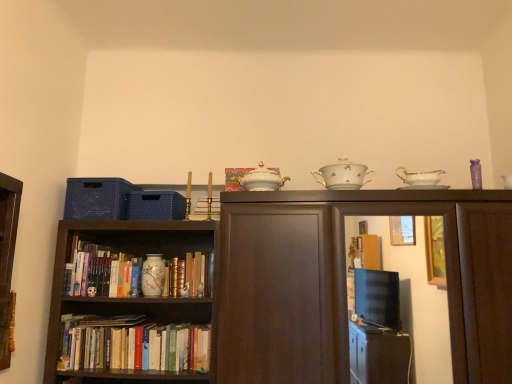
Question: Considering the positions of matte dark wood cabinet at center and porcelain vase at center, the 2th tableware when ordered from right to left, in the image, is matte dark wood cabinet at center taller or shorter than porcelain vase at center, the 2th tableware when ordered from right to left,?

Choices:
 (A) short
 (B) tall

Answer: (B)

Question: From a real-world perspective, is matte dark wood cabinet at center positioned above or below porcelain vase at center, the 2th tableware when ordered from right to left?

Choices:
 (A) below
 (B) above

Answer: (A)

Question: Which object is positioned farthest from the porcelain vase at center, the second tableware viewed from the top?

Choices:
 (A) white porcelain sugar bowl at upper center, which is the 1th tableware from right to left
 (B) matte ceramic book at center, acting as the third book starting from the front
 (C) matte dark wood cabinet at center
 (D) hardcover books at lower center, arranged as the 2th book when viewed from the front
 (E) porcelain bowl at upper center, which appears as the 1th book when viewed from the top

Answer: (A)

Question: Estimate the real-world distances between objects in this image. Which object is closer to the porcelain bowl at upper center, which appears as the 1th book when viewed from the top?

Choices:
 (A) matte dark wood cabinet at center
 (B) matte ceramic book at center, acting as the third book starting from the front
 (C) porcelain vase at center, which appears as the 1th tableware when ordered from the bottom
 (D) hardcover books at lower center, which is counted as the third book, starting from the top
 (E) white porcelain sugar bowl at upper center, acting as the 1th tableware starting from the front

Answer: (E)